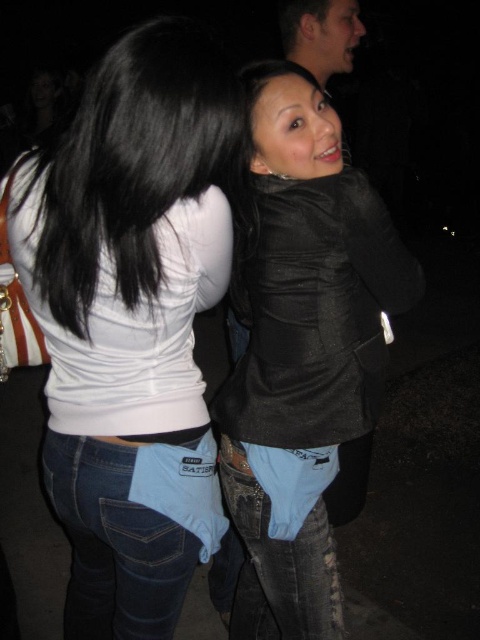
Question: Which object is closer to the camera taking this photo?

Choices:
 (A) black leather jacket at center
 (B) matte black hair at upper center
 (C) white matte tank top at upper left

Answer: (C)

Question: Is black leather jacket at center closer to camera compared to matte black hair at upper center?

Choices:
 (A) no
 (B) yes

Answer: (B)

Question: Based on their relative distances, which object is farther from the matte black hair at upper center?

Choices:
 (A) black leather jacket at center
 (B) white matte tank top at upper left

Answer: (B)

Question: Can you confirm if black leather jacket at center is positioned to the left of matte black hair at upper center?

Choices:
 (A) yes
 (B) no

Answer: (A)

Question: Which point is closer to the camera?

Choices:
 (A) (74, 620)
 (B) (303, 58)

Answer: (A)

Question: From the image, what is the correct spatial relationship of white matte tank top at upper left in relation to matte black hair at upper center?

Choices:
 (A) left
 (B) right

Answer: (A)